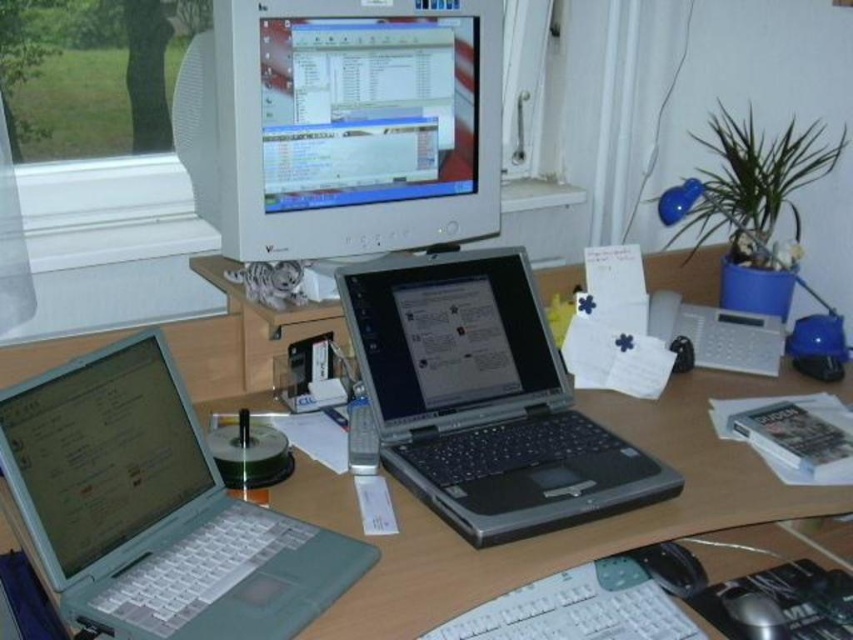
Question: Estimate the real-world distances between objects in this image. Which object is farther from the white plastic keyboard at lower center?

Choices:
 (A) light gray plastic laptop at left
 (B) black plastic mouse at lower right
 (C) white glossy computer monitor at upper center
 (D) silver metallic desk at center

Answer: (C)

Question: Which point is farther from the camera taking this photo?

Choices:
 (A) (125, 410)
 (B) (664, 257)
 (C) (555, 586)
 (D) (206, 83)

Answer: (B)

Question: In this image, where is silver metallic desk at center located relative to silver metallic laptop at left?

Choices:
 (A) above
 (B) below

Answer: (B)

Question: Can you confirm if white glossy computer monitor at upper center is smaller than silver/black laptop at center?

Choices:
 (A) yes
 (B) no

Answer: (B)

Question: In this image, where is silver/black laptop at center located relative to silver metallic desk at center?

Choices:
 (A) right
 (B) left

Answer: (A)

Question: Which of the following is the farthest from the observer?

Choices:
 (A) (544, 582)
 (B) (737, 588)
 (C) (437, 305)
 (D) (401, 531)

Answer: (C)